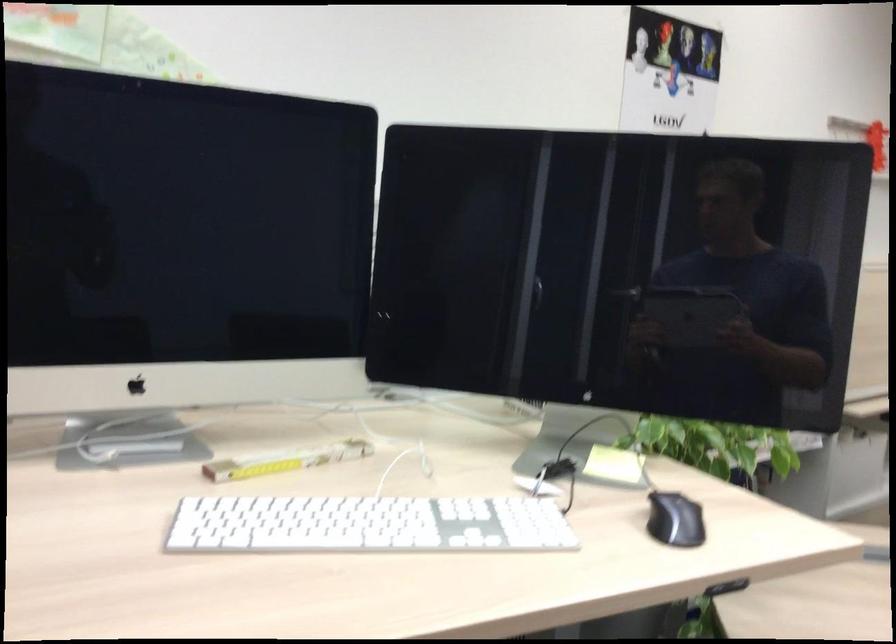
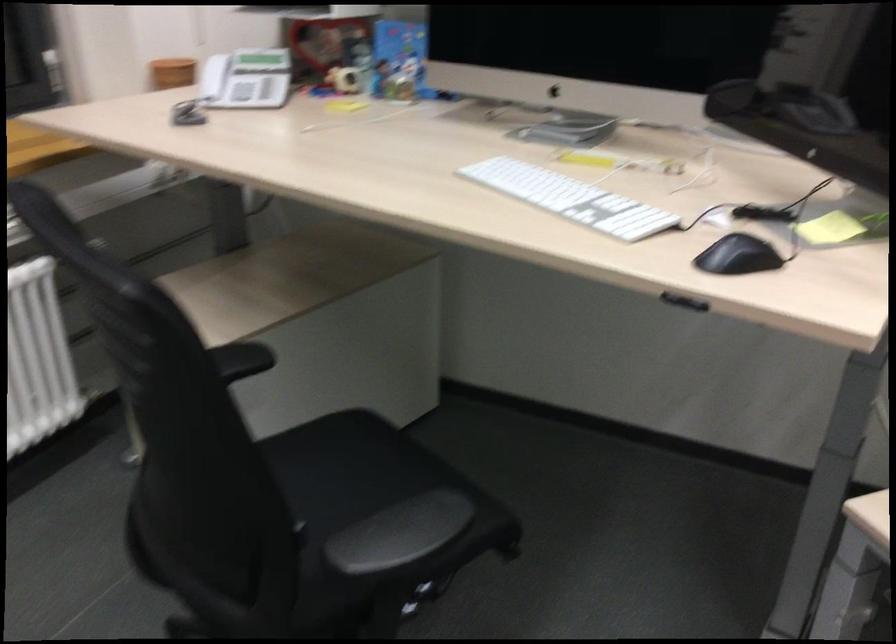
In the second image, find the point that corresponds to (673,523) in the first image.

(737, 256)